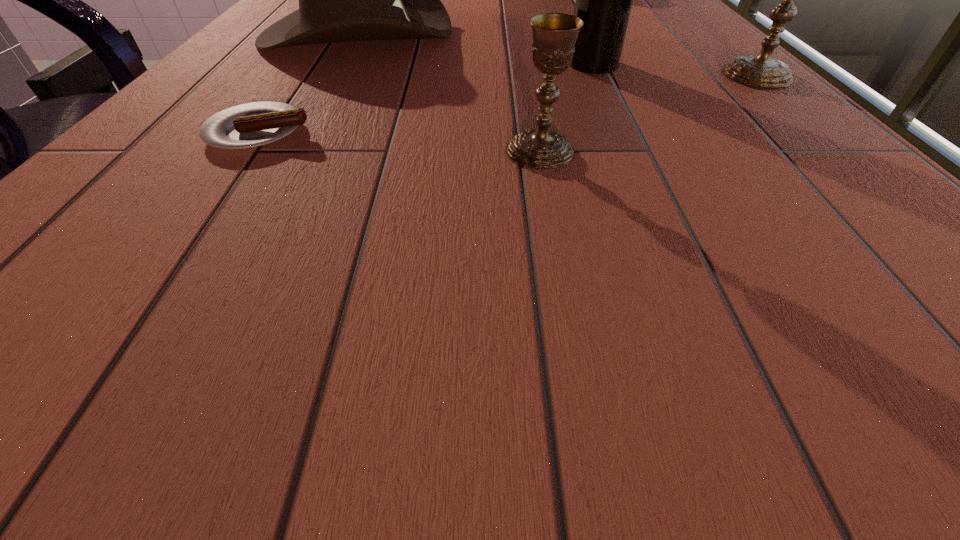
The height and width of the screenshot is (540, 960). I want to click on vacant space situated with a star on the front of the cowboy hat, so click(x=533, y=34).

The image size is (960, 540). In order to click on free space located on the label of the tallest object in this screenshot , I will do `click(503, 64)`.

This screenshot has height=540, width=960. What are the coordinates of `vacant space situated on the label of the tallest object` in the screenshot? It's located at (503, 64).

Locate an element on the screen. The width and height of the screenshot is (960, 540). vacant point located on the label of the tallest object is located at coordinates (445, 64).

What are the coordinates of `blank space located 0.210m on the back of the sausage` in the screenshot? It's located at (313, 56).

At what (x,y) coordinates should I click in order to perform the action: click on cowboy hat that is at the left edge. Please return your answer as a coordinate pair (x, y). This screenshot has width=960, height=540. Looking at the image, I should click on (340, 0).

Where is `sausage present at the left edge`? The image size is (960, 540). sausage present at the left edge is located at coordinates (249, 125).

The height and width of the screenshot is (540, 960). What are the coordinates of `object positioned at the right edge` in the screenshot? It's located at (763, 70).

Where is `vacant space at the near edge of the desktop`? vacant space at the near edge of the desktop is located at coordinates (377, 263).

Locate an element on the screen. This screenshot has height=540, width=960. blank space at the left edge of the desktop is located at coordinates (190, 191).